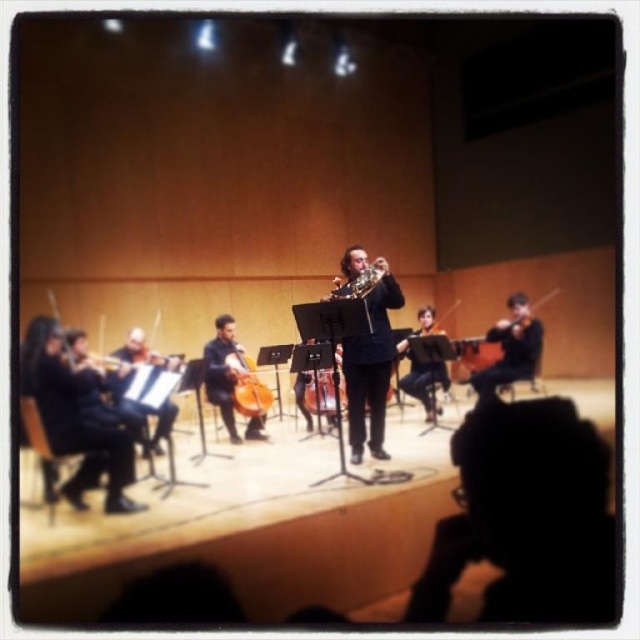
How much distance is there between wooden polished cello at center and wooden cello at center?

A distance of 31.20 centimeters exists between wooden polished cello at center and wooden cello at center.

Is wooden polished cello at center to the right of wooden cello at center from the viewer's perspective?

No, wooden polished cello at center is not to the right of wooden cello at center.

The width and height of the screenshot is (640, 640). What do you see at coordinates (248, 385) in the screenshot?
I see `wooden polished cello at center` at bounding box center [248, 385].

Where is `wooden polished cello at center`? This screenshot has height=640, width=640. wooden polished cello at center is located at coordinates (248, 385).

Does black matte violin at left lie behind wooden violin at left?

No, it is in front of wooden violin at left.

Can you confirm if black matte violin at left is bigger than wooden violin at left?

Indeed, black matte violin at left has a larger size compared to wooden violin at left.

Image resolution: width=640 pixels, height=640 pixels. Find the location of `black matte violin at left`. black matte violin at left is located at coordinates (74, 419).

Is wooden violin at left wider than wooden polished cello at center?

Yes.

Describe the element at coordinates (141, 353) in the screenshot. I see `wooden violin at left` at that location.

The height and width of the screenshot is (640, 640). I want to click on wooden violin at left, so click(141, 353).